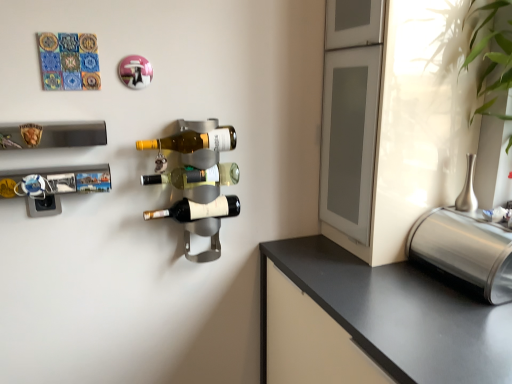
Question: Is translucent glass bottle at center, placed as the 2th beer bottle when sorted from bottom to top, located outside metallic silver wine rack at left, which appears as the 1th wine rack when ordered from the bottom?

Choices:
 (A) yes
 (B) no

Answer: (A)

Question: From a real-world perspective, is translucent glass bottle at center, placed as the 2th beer bottle when sorted from bottom to top, below metallic silver wine rack at left, which appears as the 1th wine rack when ordered from the bottom?

Choices:
 (A) no
 (B) yes

Answer: (B)

Question: Can you confirm if translucent glass bottle at center, which is the second beer bottle from top to bottom, is smaller than metallic silver wine rack at left, the 2th wine rack when ordered from top to bottom?

Choices:
 (A) no
 (B) yes

Answer: (A)

Question: Is translucent glass bottle at center, which is the second beer bottle from top to bottom, at the left side of metallic silver wine rack at left, the 2th wine rack when ordered from top to bottom?

Choices:
 (A) yes
 (B) no

Answer: (B)

Question: Would you consider translucent glass bottle at center, which is the second beer bottle from top to bottom, to be distant from metallic silver wine rack at left, which appears as the 1th wine rack when ordered from the bottom?

Choices:
 (A) yes
 (B) no

Answer: (B)

Question: From the image's perspective, is translucent glass bottle at center, placed as the 2th beer bottle when sorted from bottom to top, located beneath metallic silver wine rack at left, which appears as the 1th wine rack when ordered from the bottom?

Choices:
 (A) no
 (B) yes

Answer: (A)

Question: Is translucent glass bottle at center, which is the second beer bottle from top to bottom, not near metallic cylindrical container at right?

Choices:
 (A) yes
 (B) no

Answer: (B)

Question: Can you confirm if translucent glass bottle at center, which is the second beer bottle from top to bottom, is taller than metallic cylindrical container at right?

Choices:
 (A) no
 (B) yes

Answer: (A)

Question: Is translucent glass bottle at center, placed as the 2th beer bottle when sorted from bottom to top, bigger than metallic cylindrical container at right?

Choices:
 (A) yes
 (B) no

Answer: (B)

Question: Is the position of translucent glass bottle at center, which is the second beer bottle from top to bottom, less distant than that of metallic cylindrical container at right?

Choices:
 (A) no
 (B) yes

Answer: (A)

Question: From the image's perspective, is translucent glass bottle at center, which is the second beer bottle from top to bottom, on top of metallic cylindrical container at right?

Choices:
 (A) yes
 (B) no

Answer: (A)

Question: Is translucent glass bottle at center, placed as the 2th beer bottle when sorted from bottom to top, shorter than metallic cylindrical container at right?

Choices:
 (A) no
 (B) yes

Answer: (B)

Question: Is the position of translucent glass bottle at center, placed as the 2th beer bottle when sorted from bottom to top, less distant than that of matte glass beer bottle at center, which is the 1th beer bottle in top-to-bottom order?

Choices:
 (A) yes
 (B) no

Answer: (B)